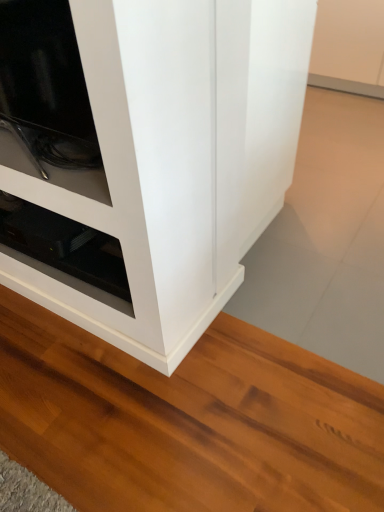
Question: Based on their sizes in the image, would you say white glossy cupboard at center is bigger or smaller than black glossy shelf at lower left?

Choices:
 (A) small
 (B) big

Answer: (B)

Question: Considering their positions, is white glossy cupboard at center located in front of or behind black glossy shelf at lower left?

Choices:
 (A) front
 (B) behind

Answer: (A)

Question: In terms of width, does white glossy cupboard at center look wider or thinner when compared to black glossy shelf at lower left?

Choices:
 (A) wide
 (B) thin

Answer: (A)

Question: Does point (87, 252) appear closer or farther from the camera than point (114, 184)?

Choices:
 (A) closer
 (B) farther

Answer: (B)

Question: Based on their positions, is black glossy shelf at lower left located to the left or right of white glossy cupboard at center?

Choices:
 (A) left
 (B) right

Answer: (A)

Question: Is black glossy shelf at lower left in front of or behind white glossy cupboard at center in the image?

Choices:
 (A) behind
 (B) front

Answer: (A)

Question: Considering the positions of black glossy shelf at lower left and white glossy cupboard at center in the image, is black glossy shelf at lower left taller or shorter than white glossy cupboard at center?

Choices:
 (A) short
 (B) tall

Answer: (A)